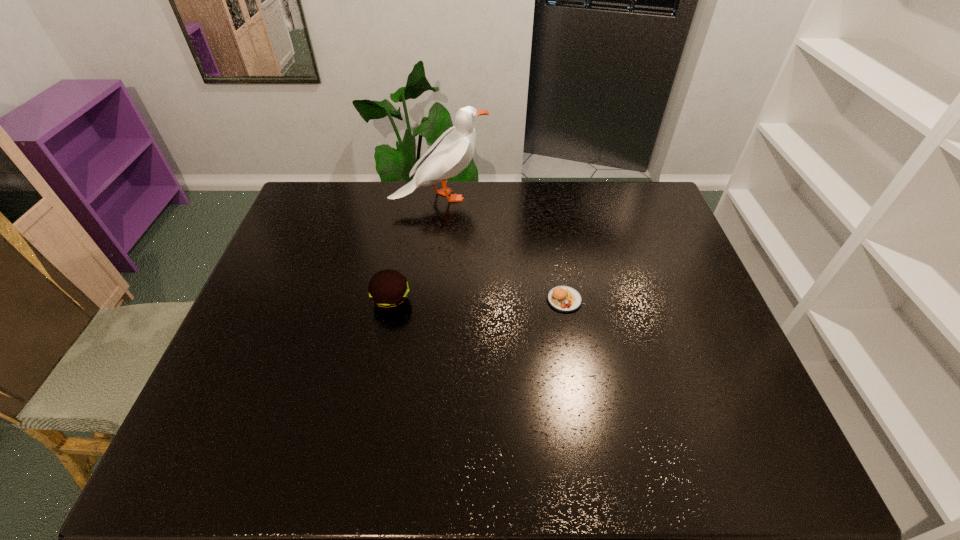
What are the coordinates of `the tallest object` in the screenshot? It's located at (451, 153).

This screenshot has width=960, height=540. Find the location of `gull`. gull is located at coordinates (451, 153).

You are a GUI agent. You are given a task and a screenshot of the screen. Output one action in this format:
    pyautogui.click(x=<x>, y=<y>)
    Task: Click on the left patty
    This screenshot has width=960, height=540.
    Given the screenshot: What is the action you would take?
    pyautogui.click(x=388, y=289)

Where is `the taller patty`? The image size is (960, 540). the taller patty is located at coordinates (388, 289).

At what (x,y) coordinates should I click in order to perform the action: click on the shortest object. Please return your answer as a coordinate pair (x, y). Looking at the image, I should click on (565, 299).

Locate an element on the screen. the shorter patty is located at coordinates (565, 299).

Where is `vacant area situated 0.340m at the beak of the farthest object`? vacant area situated 0.340m at the beak of the farthest object is located at coordinates (585, 197).

Locate an element on the screen. This screenshot has height=540, width=960. free region located on the left of the left patty is located at coordinates [280, 301].

The height and width of the screenshot is (540, 960). In order to click on blank space located 0.150m on the left of the shorter patty in this screenshot , I will do `click(492, 300)`.

Find the location of a particular element. The height and width of the screenshot is (540, 960). object present at the far edge is located at coordinates (451, 153).